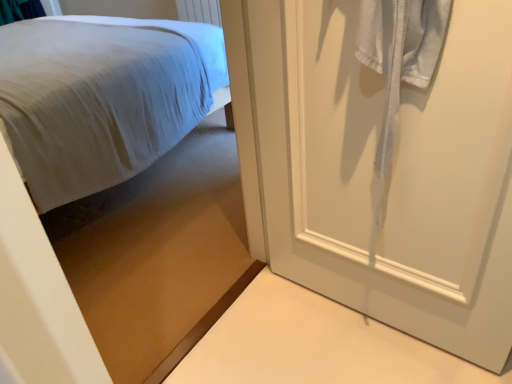
Question: Is white fabric bed at left, which is counted as the first bed, starting from the back, completely or partially inside white matte door at right?

Choices:
 (A) yes
 (B) no

Answer: (B)

Question: From a real-world perspective, is white matte door at right physically above white fabric bed at left, which is counted as the first bed, starting from the back?

Choices:
 (A) yes
 (B) no

Answer: (A)

Question: Does white matte door at right come in front of white fabric bed at left, which is counted as the first bed, starting from the back?

Choices:
 (A) yes
 (B) no

Answer: (A)

Question: Is white matte door at right further to the viewer compared to white fabric bed at left, which is counted as the first bed, starting from the back?

Choices:
 (A) yes
 (B) no

Answer: (B)

Question: Considering the relative sizes of white matte door at right and white fabric bed at left, which is counted as the first bed, starting from the back, in the image provided, is white matte door at right bigger than white fabric bed at left, which is counted as the first bed, starting from the back,?

Choices:
 (A) yes
 (B) no

Answer: (B)

Question: Would you say white fabric bed at left, marked as the second bed in a front-to-back arrangement, is inside or outside matte white bed at upper left, the second bed from the back?

Choices:
 (A) inside
 (B) outside

Answer: (B)

Question: Considering the positions of white fabric bed at left, which is counted as the first bed, starting from the back, and matte white bed at upper left, which is the first bed in front-to-back order, in the image, is white fabric bed at left, which is counted as the first bed, starting from the back, taller or shorter than matte white bed at upper left, which is the first bed in front-to-back order,?

Choices:
 (A) tall
 (B) short

Answer: (B)

Question: Is white fabric bed at left, marked as the second bed in a front-to-back arrangement, to the left or to the right of matte white bed at upper left, the second bed from the back, in the image?

Choices:
 (A) right
 (B) left

Answer: (B)

Question: Based on their sizes in the image, would you say white fabric bed at left, marked as the second bed in a front-to-back arrangement, is bigger or smaller than matte white bed at upper left, the second bed from the back?

Choices:
 (A) big
 (B) small

Answer: (A)

Question: Which is correct: white matte door at right is inside white fabric bed at left, marked as the second bed in a front-to-back arrangement, or outside of it?

Choices:
 (A) outside
 (B) inside

Answer: (A)

Question: In terms of height, does white matte door at right look taller or shorter compared to white fabric bed at left, marked as the second bed in a front-to-back arrangement?

Choices:
 (A) tall
 (B) short

Answer: (A)

Question: From the image's perspective, is white matte door at right located above or below white fabric bed at left, which is counted as the first bed, starting from the back?

Choices:
 (A) above
 (B) below

Answer: (B)

Question: From a real-world perspective, is white matte door at right physically located above or below white fabric bed at left, marked as the second bed in a front-to-back arrangement?

Choices:
 (A) below
 (B) above

Answer: (B)

Question: From the image's perspective, relative to matte white bed at upper left, the second bed from the back, is white matte door at right above or below?

Choices:
 (A) below
 (B) above

Answer: (A)

Question: Do you think white matte door at right is within matte white bed at upper left, the second bed from the back, or outside of it?

Choices:
 (A) inside
 (B) outside

Answer: (B)